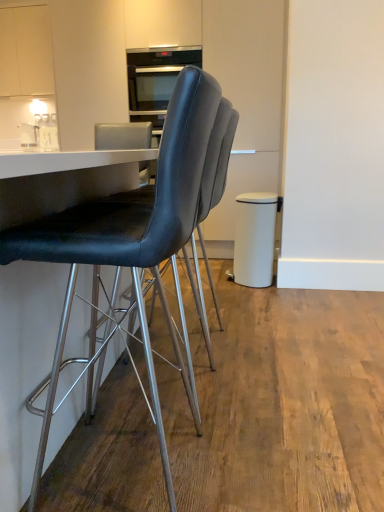
In order to click on free point to the right of black leather chair at center, placed as the second chair when sorted from back to front in this screenshot , I will do `click(284, 448)`.